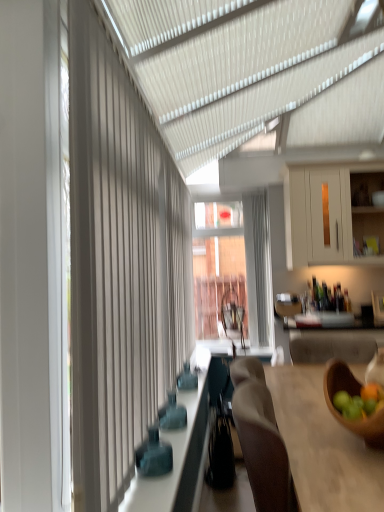
Question: Would you say wooden table at right is inside or outside matte blue glass bottles at center?

Choices:
 (A) inside
 (B) outside

Answer: (B)

Question: Is point (273, 373) closer or farther from the camera than point (183, 509)?

Choices:
 (A) farther
 (B) closer

Answer: (B)

Question: Which is nearer to the white textured curtain at left?

Choices:
 (A) white matte cabinet at upper right
 (B) matte blue glass bottles at center
 (C) wooden table at right
 (D) wooden bowl at lower right

Answer: (C)

Question: Considering the real-world distances, which object is closest to the white matte cabinet at upper right?

Choices:
 (A) matte blue glass bottles at center
 (B) white textured curtain at left
 (C) wooden table at right
 (D) wooden bowl at lower right

Answer: (A)